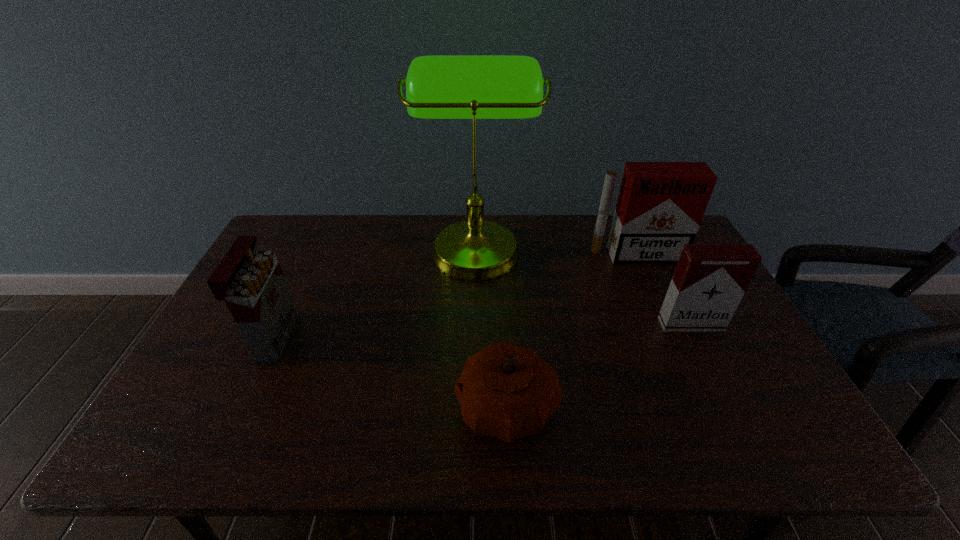
Locate an element on the screen. The image size is (960, 540). vacant space that's between the farthest cigarette_case and the leftmost cigarette_case is located at coordinates (455, 296).

Where is `free space between the farthest cigarette_case and the leftmost object`? Image resolution: width=960 pixels, height=540 pixels. free space between the farthest cigarette_case and the leftmost object is located at coordinates (455, 296).

What are the coordinates of `vacant area that lies between the farthest cigarette_case and the lamp` in the screenshot? It's located at (556, 251).

Locate an element on the screen. The image size is (960, 540). free space that is in between the shortest object and the farthest cigarette_case is located at coordinates (x=571, y=331).

Where is `free space between the lamp and the nearest object`? This screenshot has height=540, width=960. free space between the lamp and the nearest object is located at coordinates (492, 327).

Image resolution: width=960 pixels, height=540 pixels. What are the coordinates of `free space that is in between the farthest cigarette_case and the lamp` in the screenshot? It's located at tap(556, 251).

You are a GUI agent. You are given a task and a screenshot of the screen. Output one action in this format:
    pyautogui.click(x=<x>, y=<y>)
    Task: Click on the free space between the pumpkin and the leftmost cigarette_case
    The image size is (960, 540).
    Given the screenshot: What is the action you would take?
    pyautogui.click(x=391, y=372)

Where is `object that ranks as the second closest to the lamp`? This screenshot has height=540, width=960. object that ranks as the second closest to the lamp is located at coordinates (506, 391).

Identify the location of object that ranks as the third closest to the farthest cigarette_case. This screenshot has width=960, height=540. (506, 391).

Identify the location of cigarette_case that is the closest to the farthest cigarette_case. The image size is (960, 540). (709, 281).